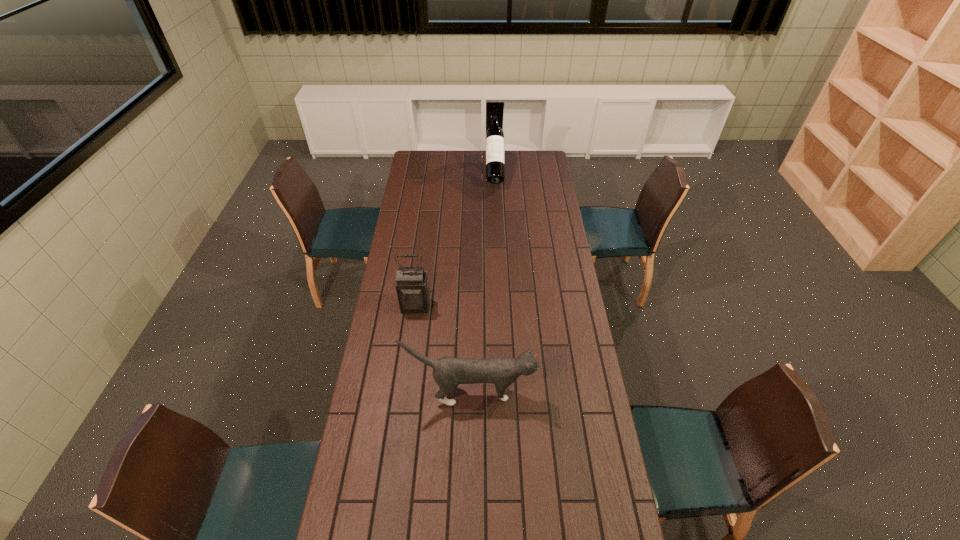
Locate an element on the screen. This screenshot has width=960, height=540. the farthest object is located at coordinates (495, 159).

In order to click on wine bottle in this screenshot , I will do `click(495, 159)`.

Where is `the nearest object`? Image resolution: width=960 pixels, height=540 pixels. the nearest object is located at coordinates (448, 372).

Where is `the second nearest object`? the second nearest object is located at coordinates (412, 287).

Image resolution: width=960 pixels, height=540 pixels. I want to click on free space located on the stand of the tallest object, so click(495, 205).

The height and width of the screenshot is (540, 960). Identify the location of free spot located at the face of the nearest object. (563, 393).

Where is `free region located on the front-facing side of the second farthest object`? This screenshot has width=960, height=540. free region located on the front-facing side of the second farthest object is located at coordinates pyautogui.click(x=413, y=326).

At what (x,y) coordinates should I click in order to perform the action: click on object at the far edge. Please return your answer as a coordinate pair (x, y). Looking at the image, I should click on (495, 159).

Locate an element on the screen. cat at the left edge is located at coordinates (448, 372).

Where is `lantern that is at the left edge`? Image resolution: width=960 pixels, height=540 pixels. lantern that is at the left edge is located at coordinates (412, 287).